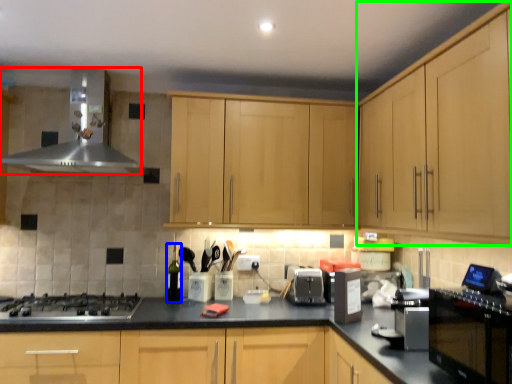
Question: Based on their relative distances, which object is nearer to home appliance (highlighted by a red box)? Choose from bottle (highlighted by a blue box) and cabinetry (highlighted by a green box).

Choices:
 (A) bottle
 (B) cabinetry

Answer: (A)